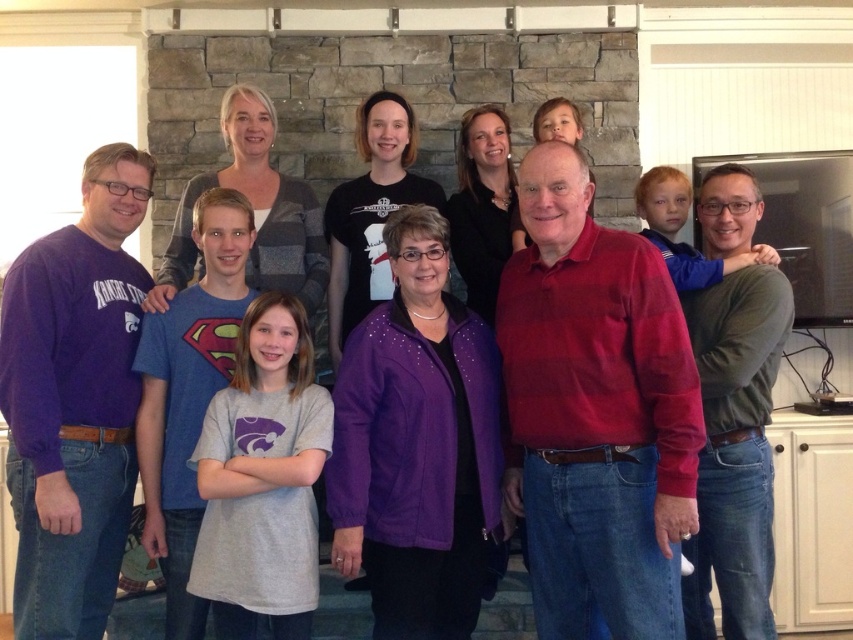
You are standing in the living room and see two points marked in the image. Which point, point (520, 365) or point (492, 362), is closer to you?

Point (520, 365) is closer to the viewer than point (492, 362).

You are a photographer trying to adjust the lighting for a group photo. You notice the red plaid shirt at center and the green sweater at center. Which clothing item is positioned higher in the image?

The red plaid shirt at center is located above the green sweater at center, so it is positioned higher in the image.